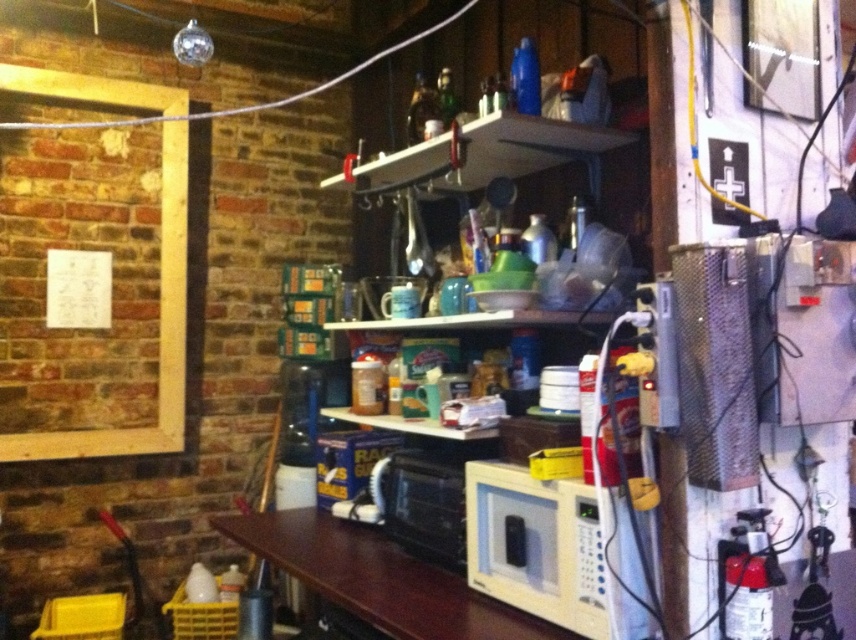
What is located at the coordinates point (536, 545) in the image?

The point (536, 545) indicates the location of the white matte microwave at center.

You are organizing a small kitchen space and need to place a new appliance that requires 1.2 square meters of space. Given the brown wood table at center and the white plastic microwave at center, which object can accommodate this appliance based on their sizes?

The brown wood table at center is bigger than the white plastic microwave at center, so the brown wood table at center can accommodate the appliance requiring 1.2 square meters of space.